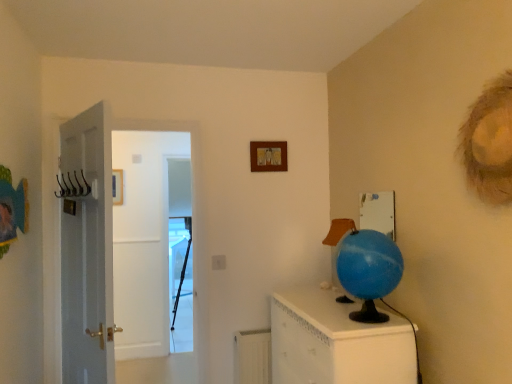
Based on the photo, measure the distance between wooden picture frame at upper center and camera.

A distance of 8.91 feet exists between wooden picture frame at upper center and camera.

Find the location of a particular element. This screenshot has height=384, width=512. metallic wire hanger at left is located at coordinates tap(72, 185).

Would you say blue glossy globe at right is part of metallic wire hanger at left's contents?

Actually, blue glossy globe at right is outside metallic wire hanger at left.

From the image's perspective, relative to blue glossy globe at right, is metallic wire hanger at left above or below?

metallic wire hanger at left is situated higher than blue glossy globe at right in the image.

How different are the orientations of metallic wire hanger at left and blue glossy globe at right in degrees?

They differ by 112 degrees in their facing directions.

Where is `hanger that is behind the blue glossy globe at right`? hanger that is behind the blue glossy globe at right is located at coordinates (72, 185).

Between transparent plastic screen door at center and white plastic radiator at lower center, which one is positioned behind?

transparent plastic screen door at center is more distant.

From a real-world perspective, is transparent plastic screen door at center physically below white plastic radiator at lower center?

No.

Can you confirm if transparent plastic screen door at center is smaller than white plastic radiator at lower center?

No, transparent plastic screen door at center is not smaller than white plastic radiator at lower center.

How much distance is there between blue glossy globe at right and white plastic radiator at lower center?

A distance of 18.38 inches exists between blue glossy globe at right and white plastic radiator at lower center.

Between point (296, 326) and point (234, 351), which one is positioned behind?

The point (234, 351) is more distant.

Is blue glossy globe at right next to white plastic radiator at lower center?

No, blue glossy globe at right is not next to white plastic radiator at lower center.

Considering the relative sizes of blue glossy globe at right and white plastic radiator at lower center in the image provided, is blue glossy globe at right shorter than white plastic radiator at lower center?

Incorrect, the height of blue glossy globe at right does not fall short of that of white plastic radiator at lower center.

From a real-world perspective, which object stands above the other?

metallic wire hanger at left, from a real-world perspective.

Looking at their sizes, would you say metallic wire hanger at left is wider or thinner than blue rubber globe at right?

metallic wire hanger at left is wider than blue rubber globe at right.

Choose the correct answer: Is metallic wire hanger at left inside blue rubber globe at right or outside it?

metallic wire hanger at left is located beyond the bounds of blue rubber globe at right.

Is wooden picture frame at upper center surrounded by transparent plastic screen door at center?

Actually, wooden picture frame at upper center is outside transparent plastic screen door at center.

Based on the photo, from a real-world perspective, who is located higher, transparent plastic screen door at center or wooden picture frame at upper center?

In real-world perspective, wooden picture frame at upper center is above.

From the image's perspective, is transparent plastic screen door at center below wooden picture frame at upper center?

Correct, transparent plastic screen door at center appears lower than wooden picture frame at upper center in the image.

Which object is further away from the camera taking this photo, transparent plastic screen door at center or wooden picture frame at upper center?

transparent plastic screen door at center is further away from the camera.

Is the surface of blue rubber globe at right in direct contact with wooden picture frame at upper center?

No, blue rubber globe at right is not with wooden picture frame at upper center.

Consider the image. Who is taller, blue rubber globe at right or wooden picture frame at upper center?

blue rubber globe at right is taller.

Could you tell me if blue rubber globe at right is facing wooden picture frame at upper center?

No, blue rubber globe at right does not turn towards wooden picture frame at upper center.

Does point (324, 242) come farther from viewer compared to point (273, 158)?

Yes, point (324, 242) is behind point (273, 158).

From a real-world perspective, does wooden picture frame at upper center stand above metallic wire hanger at left?

Correct, in the physical world, wooden picture frame at upper center is higher than metallic wire hanger at left.

Is wooden picture frame at upper center to the right of metallic wire hanger at left from the viewer's perspective?

Yes.

Is wooden picture frame at upper center facing towards metallic wire hanger at left?

No, wooden picture frame at upper center does not turn towards metallic wire hanger at left.

In the scene shown: Looking at their sizes, would you say wooden picture frame at upper center is wider or thinner than metallic wire hanger at left?

In the image, wooden picture frame at upper center appears to be more narrow than metallic wire hanger at left.

Image resolution: width=512 pixels, height=384 pixels. I want to click on furniture below the metallic wire hanger at left (from the image's perspective), so click(336, 342).

You are a GUI agent. You are given a task and a screenshot of the screen. Output one action in this format:
    pyautogui.click(x=<x>, y=<y>)
    Task: Click on the screen door located on the left of white plastic radiator at lower center
    The height and width of the screenshot is (384, 512).
    Given the screenshot: What is the action you would take?
    pyautogui.click(x=180, y=254)

Which object lies nearer to the anchor point wooden picture frame at upper center, metallic wire hanger at left or blue rubber globe at right?

blue rubber globe at right.

From the image, which object appears to be farther from metallic wire hanger at left, wooden picture frame at upper center or transparent plastic screen door at center?

transparent plastic screen door at center is positioned further to the anchor metallic wire hanger at left.

Looking at the image, which one is located closer to wooden picture frame at upper center, blue glossy globe at right or blue rubber globe at right?

Based on the image, blue rubber globe at right appears to be nearer to wooden picture frame at upper center.

Based on the photo, considering their positions, is metallic wire hanger at left positioned further to wooden picture frame at upper center than transparent plastic screen door at center?

The object further to wooden picture frame at upper center is transparent plastic screen door at center.

From the image, which object appears to be nearer to blue glossy globe at right, wooden picture frame at upper center or metallic wire hanger at left?

Based on the image, wooden picture frame at upper center appears to be nearer to blue glossy globe at right.

Considering their positions, is transparent plastic screen door at center positioned closer to wooden picture frame at upper center than metallic wire hanger at left?

Among the two, metallic wire hanger at left is located nearer to wooden picture frame at upper center.

When comparing their distances from blue rubber globe at right, does wooden picture frame at upper center or transparent plastic screen door at center seem closer?

wooden picture frame at upper center.

Based on the photo, which object lies nearer to the anchor point blue glossy globe at right, wooden picture frame at upper center or blue rubber globe at right?

The object closer to blue glossy globe at right is blue rubber globe at right.

Where is `picture frame between blue rubber globe at right and transparent plastic screen door at center along the z-axis`? This screenshot has width=512, height=384. picture frame between blue rubber globe at right and transparent plastic screen door at center along the z-axis is located at coordinates (268, 156).

Where is `furniture between metallic wire hanger at left and blue rubber globe at right from left to right`? The width and height of the screenshot is (512, 384). furniture between metallic wire hanger at left and blue rubber globe at right from left to right is located at coordinates (336, 342).

Locate an element on the screen. picture frame between metallic wire hanger at left and transparent plastic screen door at center from front to back is located at coordinates (268, 156).

This screenshot has height=384, width=512. Identify the location of hanger located between blue glossy globe at right and transparent plastic screen door at center in the depth direction. (72, 185).